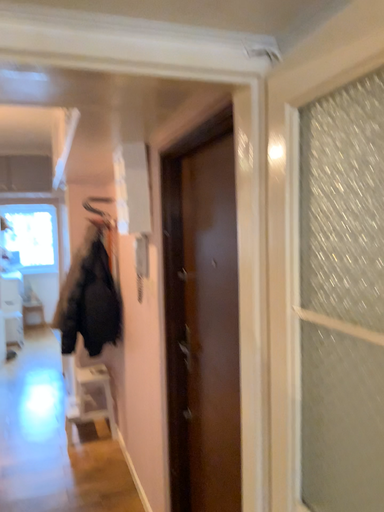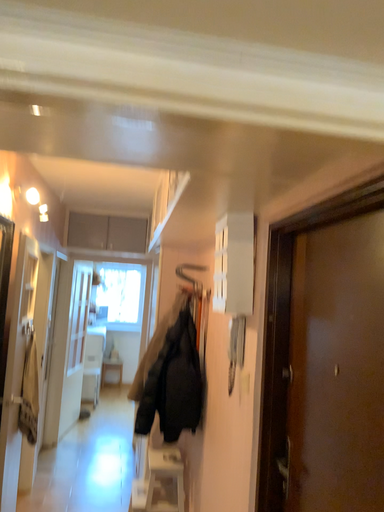
Question: Which way did the camera rotate in the video?

Choices:
 (A) rotated upward
 (B) rotated downward

Answer: (A)